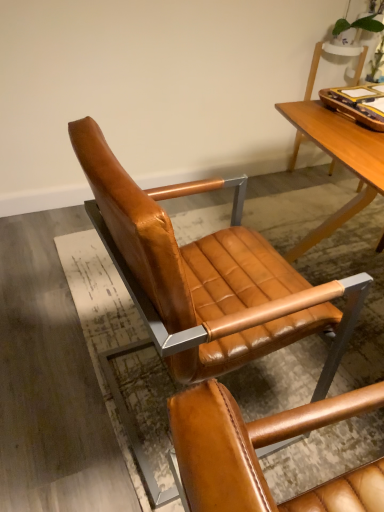
Describe the element at coordinates (354, 108) in the screenshot. Image resolution: width=384 pixels, height=512 pixels. I see `brown leather tray at upper right` at that location.

Locate an element on the screen. brown leather tray at upper right is located at coordinates (354, 108).

The height and width of the screenshot is (512, 384). Describe the element at coordinates (205, 275) in the screenshot. I see `cognac leather chair at center` at that location.

Locate an element on the screen. This screenshot has width=384, height=512. cognac leather chair at center is located at coordinates (205, 275).

What is the approximate height of cognac leather chair at center?

35.70 inches.

The height and width of the screenshot is (512, 384). I want to click on brown leather tray at upper right, so click(354, 108).

Is cognac leather chair at center to the left of brown leather tray at upper right from the viewer's perspective?

Yes.

Is cognac leather chair at center positioned before brown leather tray at upper right?

Yes, cognac leather chair at center is closer to the viewer.

Which is nearer, (x=237, y=181) or (x=349, y=110)?

The point (x=349, y=110) is in front.

From the image's perspective, does cognac leather chair at center appear lower than brown leather tray at upper right?

Yes.

From a real-world perspective, is cognac leather chair at center physically located above or below brown leather tray at upper right?

Clearly, from a real-world perspective, cognac leather chair at center is below brown leather tray at upper right.

Considering the sizes of objects cognac leather chair at center and brown leather tray at upper right in the image provided, who is thinner, cognac leather chair at center or brown leather tray at upper right?

Thinner between the two is brown leather tray at upper right.

Is cognac leather chair at center taller or shorter than brown leather tray at upper right?

Considering their sizes, cognac leather chair at center has more height than brown leather tray at upper right.

Who is smaller, cognac leather chair at center or brown leather tray at upper right?

brown leather tray at upper right is smaller.

Is cognac leather chair at center inside or outside of brown leather tray at upper right?

cognac leather chair at center is spatially situated outside brown leather tray at upper right.

Is cognac leather chair at center next to brown leather tray at upper right?

cognac leather chair at center and brown leather tray at upper right are clearly separated.

Is cognac leather chair at center oriented towards brown leather tray at upper right?

Yes, cognac leather chair at center faces towards brown leather tray at upper right.

How much distance is there between cognac leather chair at center and brown leather tray at upper right?

cognac leather chair at center and brown leather tray at upper right are 31.18 inches apart from each other.

Find the location of a particular element. Image resolution: width=384 pixels, height=512 pixels. tray behind the cognac leather chair at center is located at coordinates (354, 108).

Does brown leather tray at upper right appear on the right side of cognac leather chair at center?

Correct, you'll find brown leather tray at upper right to the right of cognac leather chair at center.

Which object is closer to the camera taking this photo, brown leather tray at upper right or cognac leather chair at center?

Positioned in front is cognac leather chair at center.

Which is less distant, (326, 104) or (125, 284)?

Clearly, point (326, 104) is more distant from the camera than point (125, 284).

From the image's perspective, is brown leather tray at upper right below cognac leather chair at center?

Actually, brown leather tray at upper right appears above cognac leather chair at center in the image.

From a real-world perspective, is brown leather tray at upper right positioned above or below cognac leather chair at center?

brown leather tray at upper right is above cognac leather chair at center.

Based on the photo, considering the relative sizes of brown leather tray at upper right and cognac leather chair at center in the image provided, is brown leather tray at upper right thinner than cognac leather chair at center?

Yes.

In terms of height, does brown leather tray at upper right look taller or shorter compared to cognac leather chair at center?

In the image, brown leather tray at upper right appears to be shorter than cognac leather chair at center.

Considering the sizes of brown leather tray at upper right and cognac leather chair at center in the image, is brown leather tray at upper right bigger or smaller than cognac leather chair at center?

Considering their sizes, brown leather tray at upper right takes up less space than cognac leather chair at center.

Is brown leather tray at upper right inside the boundaries of cognac leather chair at center, or outside?

brown leather tray at upper right exists outside the volume of cognac leather chair at center.

Would you consider brown leather tray at upper right to be distant from cognac leather chair at center?

Actually, brown leather tray at upper right and cognac leather chair at center are a little close together.

In the scene shown: Is brown leather tray at upper right facing towards cognac leather chair at center?

No, brown leather tray at upper right is not facing towards cognac leather chair at center.

Where is `tray that is above the cognac leather chair at center (from a real-world perspective)`? This screenshot has height=512, width=384. tray that is above the cognac leather chair at center (from a real-world perspective) is located at coordinates (354, 108).

Identify the location of chair lying on the left of brown leather tray at upper right. The width and height of the screenshot is (384, 512). (205, 275).

Identify the location of tray behind the cognac leather chair at center. (354, 108).